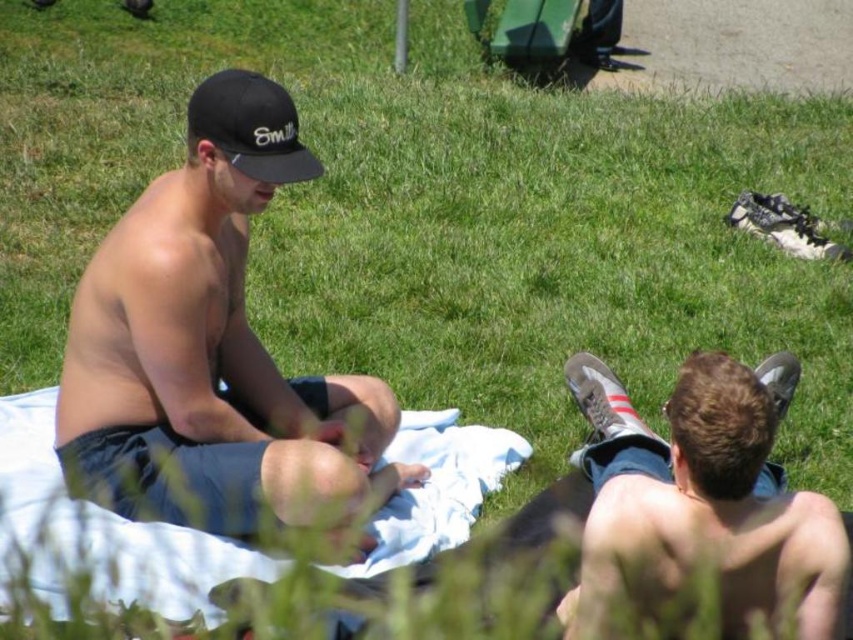
Question: Can you confirm if matte black cap at upper left is positioned below white cloth at center?

Choices:
 (A) no
 (B) yes

Answer: (A)

Question: Which of the following is the farthest from the observer?

Choices:
 (A) (35, 586)
 (B) (296, 113)
 (C) (759, 388)

Answer: (B)

Question: Which object is the farthest from the matte gray sneakers at lower right?

Choices:
 (A) white cloth at center
 (B) black matte baseball cap at upper left
 (C) matte black cap at upper left

Answer: (B)

Question: Based on their relative distances, which object is nearer to the matte black cap at upper left?

Choices:
 (A) black matte baseball cap at upper left
 (B) matte gray sneakers at lower right

Answer: (A)

Question: Does matte gray sneakers at lower right appear on the left side of black matte baseball cap at upper left?

Choices:
 (A) yes
 (B) no

Answer: (B)

Question: Can you confirm if matte black cap at upper left is positioned below white cloth at center?

Choices:
 (A) yes
 (B) no

Answer: (B)